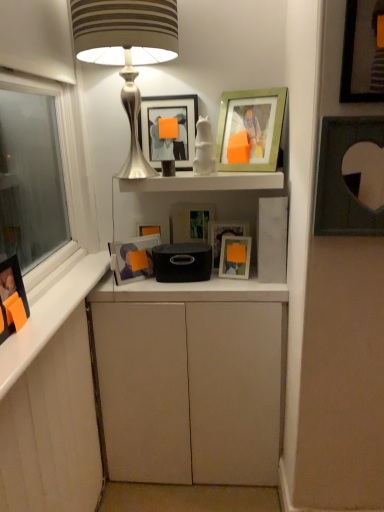
From the picture: Measure the distance between point (278, 187) and camera.

A distance of 1.57 meters exists between point (278, 187) and camera.

Identify the location of white glossy shelf at upper center. (x=205, y=182).

Identify the location of matte white picture frame at center, which is the fifth picture frame from left to right. (222, 234).

Where is `green matte picture frame at upper center, the seventh picture frame positioned from the left`? This screenshot has width=384, height=512. green matte picture frame at upper center, the seventh picture frame positioned from the left is located at coordinates (250, 130).

The image size is (384, 512). Describe the element at coordinates (191, 381) in the screenshot. I see `matte white cabinet at center` at that location.

You are a GUI agent. You are given a task and a screenshot of the screen. Output one action in this format:
    pyautogui.click(x=<x>, y=<y>)
    Task: Click on the matte glass picture frame at center, which is the 8th picture frame in right-to-left order
    
    Given the screenshot: What is the action you would take?
    pyautogui.click(x=133, y=258)

Is point (342, 156) in front of point (113, 249)?

Yes, point (342, 156) is closer to viewer.

Can you confirm if matte black picture frame at upper right, which appears as the second picture frame when viewed from the right, is positioned to the left of matte glass picture frame at center, arranged as the 2th picture frame when viewed from the left?

In fact, matte black picture frame at upper right, which appears as the second picture frame when viewed from the right, is to the right of matte glass picture frame at center, arranged as the 2th picture frame when viewed from the left.

Is matte black picture frame at upper right, which appears as the second picture frame when viewed from the right, facing towards matte glass picture frame at center, which is the 8th picture frame in right-to-left order?

No, matte black picture frame at upper right, which appears as the second picture frame when viewed from the right, is not aimed at matte glass picture frame at center, which is the 8th picture frame in right-to-left order.

Is matte black picture frame at upper right, which appears as the second picture frame when viewed from the right, closer to camera compared to matte glass picture frame at center, arranged as the 2th picture frame when viewed from the left?

Yes, matte black picture frame at upper right, which appears as the second picture frame when viewed from the right, is closer to the camera.

Is the position of white matte counter top at lower left less distant than that of matte white picture frame at center, which is the fifth picture frame from left to right?

Yes, white matte counter top at lower left is in front of matte white picture frame at center, which is the fifth picture frame from left to right.

Is white matte counter top at lower left wider than matte white picture frame at center, arranged as the fifth picture frame when viewed from the right?

Yes, white matte counter top at lower left is wider than matte white picture frame at center, arranged as the fifth picture frame when viewed from the right.

Is white matte counter top at lower left facing away from matte white picture frame at center, which is the fifth picture frame from left to right?

No, white matte counter top at lower left's orientation is not away from matte white picture frame at center, which is the fifth picture frame from left to right.

From a real-world perspective, who is located higher, white matte counter top at lower left or matte white picture frame at center, which is the fifth picture frame from left to right?

From a 3D spatial view, matte white picture frame at center, which is the fifth picture frame from left to right, is above.

I want to click on the 5th picture frame positioned below the matte black picture frame at upper right, the ninth picture frame from the left (from a real-world perspective), so click(190, 222).

Which of these two, matte black picture frame at center, which appears as the fourth picture frame when viewed from the left, or matte black picture frame at upper right, the ninth picture frame from the left, stands taller?

Standing taller between the two is matte black picture frame at upper right, the ninth picture frame from the left.

Does point (201, 216) come in front of point (341, 83)?

No, (201, 216) is behind (341, 83).

Is silver metallic lamp at upper center in front of matte white cabinet at center?

Yes.

From a real-world perspective, which object stands above the other?

silver metallic lamp at upper center is physically above.

Would you say silver metallic lamp at upper center is to the left or to the right of matte white cabinet at center in the picture?

silver metallic lamp at upper center is positioned on matte white cabinet at center's left side.

From a real-world perspective, who is located lower, matte black picture frame at center, which appears as the fourth picture frame when viewed from the left, or matte glass picture frame at center, which is the 8th picture frame in right-to-left order?

matte glass picture frame at center, which is the 8th picture frame in right-to-left order, is physically lower.

Which of these two, matte black picture frame at center, which is the 6th picture frame from right to left, or matte glass picture frame at center, which is the 8th picture frame in right-to-left order, is bigger?

matte glass picture frame at center, which is the 8th picture frame in right-to-left order, is bigger.

Is there a large distance between matte black picture frame at center, which is the 6th picture frame from right to left, and matte glass picture frame at center, arranged as the 2th picture frame when viewed from the left?

matte black picture frame at center, which is the 6th picture frame from right to left, is actually quite close to matte glass picture frame at center, arranged as the 2th picture frame when viewed from the left.

Between matte black picture frame at center, which is the 6th picture frame from right to left, and matte glass picture frame at center, which is the 8th picture frame in right-to-left order, which one appears on the right side from the viewer's perspective?

matte black picture frame at center, which is the 6th picture frame from right to left, is more to the right.

Is matte silver picture frame at center, arranged as the 6th picture frame when viewed from the left, outside of matte black picture frame at center, which is the 6th picture frame from right to left?

Yes.

In the image, is matte silver picture frame at center, the 4th picture frame from the right, positioned in front of or behind matte black picture frame at center, which appears as the fourth picture frame when viewed from the left?

matte silver picture frame at center, the 4th picture frame from the right, is positioned closer to the viewer than matte black picture frame at center, which appears as the fourth picture frame when viewed from the left.

Considering the sizes of objects matte silver picture frame at center, the 4th picture frame from the right, and matte black picture frame at center, which is the 6th picture frame from right to left, in the image provided, who is smaller, matte silver picture frame at center, the 4th picture frame from the right, or matte black picture frame at center, which is the 6th picture frame from right to left,?

matte silver picture frame at center, the 4th picture frame from the right.

Which object is positioned more to the right, matte silver picture frame at center, the 4th picture frame from the right, or matte black picture frame at center, which is the 6th picture frame from right to left?

matte silver picture frame at center, the 4th picture frame from the right.

Would you consider green matte picture frame at upper center, which ranks as the third picture frame in right-to-left order, to be distant from matte black picture frame at upper center, which appears as the 7th picture frame when viewed from the right?

No.

Identify the location of the 4th picture frame to the left of the green matte picture frame at upper center, which ranks as the third picture frame in right-to-left order, counting from the anchor's position. (168, 139).

From the image's perspective, relative to matte black picture frame at upper center, which appears as the 7th picture frame when viewed from the right, is green matte picture frame at upper center, the seventh picture frame positioned from the left, above or below?

Clearly, from the image's perspective, green matte picture frame at upper center, the seventh picture frame positioned from the left, is below matte black picture frame at upper center, which appears as the 7th picture frame when viewed from the right.

Which is more to the right, green matte picture frame at upper center, the seventh picture frame positioned from the left, or matte black picture frame at upper center, which appears as the 7th picture frame when viewed from the right?

green matte picture frame at upper center, the seventh picture frame positioned from the left, is more to the right.

This screenshot has height=512, width=384. There is a matte black picture frame at upper right, placed as the eighth picture frame when sorted from left to right. What are the coordinates of `the 4th picture frame below it (from the image's perspective)` in the screenshot? It's located at (133, 258).

Where is `counter top lying in front of the matte white picture frame at center, arranged as the fifth picture frame when viewed from the right`? The image size is (384, 512). counter top lying in front of the matte white picture frame at center, arranged as the fifth picture frame when viewed from the right is located at coordinates (49, 317).

Considering their positions, is matte white cabinet at center positioned further to matte black picture frame at center, which appears as the fourth picture frame when viewed from the left, than matte black picture frame at upper right, the ninth picture frame from the left?

matte black picture frame at upper right, the ninth picture frame from the left.

Looking at the image, which one is located further to matte black picture frame at upper right, which is the first picture frame from right to left, matte black picture frame at left, the ninth picture frame positioned from the right, or green matte picture frame at upper center, which ranks as the third picture frame in right-to-left order?

Among the two, matte black picture frame at left, the ninth picture frame positioned from the right, is located further to matte black picture frame at upper right, which is the first picture frame from right to left.

Considering their positions, is white matte counter top at lower left positioned closer to matte glass picture frame at center, arranged as the 2th picture frame when viewed from the left, than green matte picture frame at upper center, the seventh picture frame positioned from the left?

Based on the image, white matte counter top at lower left appears to be nearer to matte glass picture frame at center, arranged as the 2th picture frame when viewed from the left.

Looking at the image, which one is located closer to matte black picture frame at center, which is the 6th picture frame from right to left, matte black picture frame at upper right, placed as the eighth picture frame when sorted from left to right, or matte black picture frame at upper center, which appears as the 7th picture frame when viewed from the right?

Based on the image, matte black picture frame at upper center, which appears as the 7th picture frame when viewed from the right, appears to be nearer to matte black picture frame at center, which is the 6th picture frame from right to left.

From the image, which object appears to be nearer to matte white picture frame at center, which is the fifth picture frame from left to right, matte black picture frame at center, which is the 6th picture frame from right to left, or white glossy shelf at upper center?

matte black picture frame at center, which is the 6th picture frame from right to left, is closer to matte white picture frame at center, which is the fifth picture frame from left to right.

Which object lies further to the anchor point white matte counter top at lower left, matte white cabinet at center or matte black picture frame at upper right, placed as the eighth picture frame when sorted from left to right?

matte black picture frame at upper right, placed as the eighth picture frame when sorted from left to right.

In the scene shown: Looking at the image, which one is located further to green matte picture frame at upper center, the seventh picture frame positioned from the left, silver metallic lamp at upper center or white glossy shelf at upper center?

silver metallic lamp at upper center lies further to green matte picture frame at upper center, the seventh picture frame positioned from the left, than the other object.

Based on their spatial positions, is white glossy shelf at upper center or matte black picture frame at upper right, the ninth picture frame from the left, further from matte black picture frame at upper center, which appears as the 7th picture frame when viewed from the right?

matte black picture frame at upper right, the ninth picture frame from the left, is positioned further to the anchor matte black picture frame at upper center, which appears as the 7th picture frame when viewed from the right.

Find the location of a particular element. The height and width of the screenshot is (512, 384). shelf located between matte black picture frame at upper right, which appears as the second picture frame when viewed from the right, and matte black picture frame at center, which is the 6th picture frame from right to left, in the depth direction is located at coordinates (x=205, y=182).

Image resolution: width=384 pixels, height=512 pixels. Identify the location of cabinetry between matte black picture frame at left, which is counted as the first picture frame, starting from the left, and matte glass picture frame at center, which is the 8th picture frame in right-to-left order, along the z-axis. (191, 381).

Find the location of a particular element. The image size is (384, 512). lamp between white matte counter top at lower left and matte white picture frame at center, which is the fifth picture frame from left to right, along the z-axis is located at coordinates (126, 52).

Where is `cabinetry located between white matte counter top at lower left and matte white picture frame at center, which is the fifth picture frame from left to right, in the depth direction`? This screenshot has height=512, width=384. cabinetry located between white matte counter top at lower left and matte white picture frame at center, which is the fifth picture frame from left to right, in the depth direction is located at coordinates (191, 381).